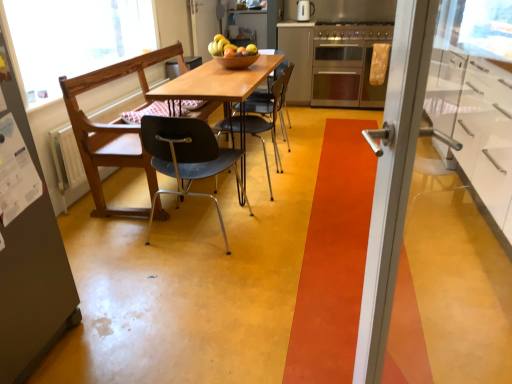
Where is `free space in front of wooden chair at center, the 2th chair when ordered from front to back`? free space in front of wooden chair at center, the 2th chair when ordered from front to back is located at coordinates (217, 262).